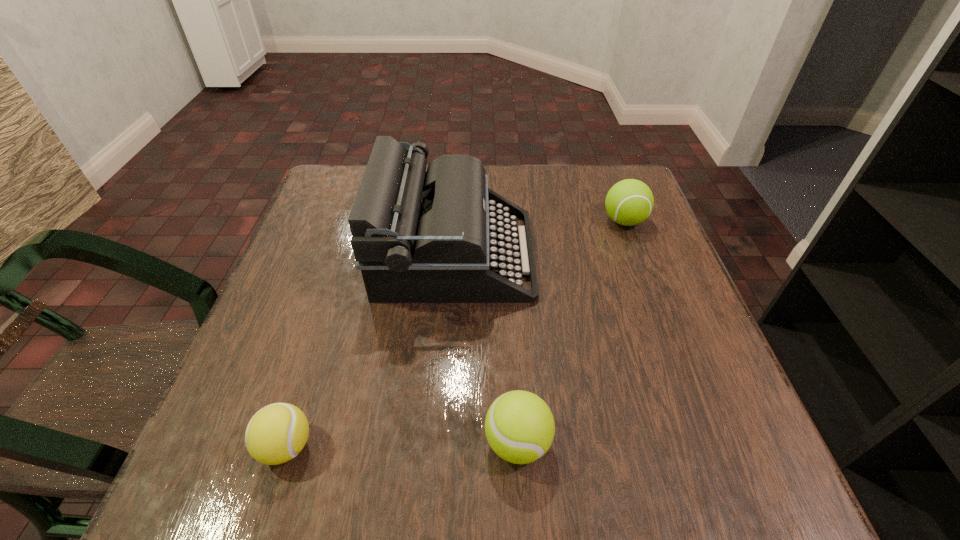
Identify the location of empty space between the shortest tennis ball and the typewriter. (371, 350).

Identify the location of vacant region between the second tennis ball from right to left and the rightmost object. (571, 332).

Choose which object is the second nearest neighbor to the leftmost tennis ball. Please provide its 2D coordinates. Your answer should be formatted as a tuple, i.e. [(x, y)], where the tuple contains the x and y coordinates of a point satisfying the conditions above.

[(519, 426)]

Point out which object is positioned as the second nearest to the leftmost tennis ball. Please provide its 2D coordinates. Your answer should be formatted as a tuple, i.e. [(x, y)], where the tuple contains the x and y coordinates of a point satisfying the conditions above.

[(519, 426)]

Identify the location of tennis ball object that ranks as the third closest to the tallest object. (277, 433).

The width and height of the screenshot is (960, 540). What are the coordinates of `the second closest tennis ball relative to the shortest tennis ball` in the screenshot? It's located at 629,202.

The width and height of the screenshot is (960, 540). What are the coordinates of `blank area in the image that satisfies the following two spatial constraints: 1. on the back side of the rightmost object; 2. on the right side of the leftmost object` in the screenshot? It's located at (358, 221).

This screenshot has width=960, height=540. Find the location of `vacant space that satisfies the following two spatial constraints: 1. on the typing side of the typewriter; 2. on the back side of the second tennis ball from right to left`. vacant space that satisfies the following two spatial constraints: 1. on the typing side of the typewriter; 2. on the back side of the second tennis ball from right to left is located at coordinates (444, 442).

You are a GUI agent. You are given a task and a screenshot of the screen. Output one action in this format:
    pyautogui.click(x=<x>, y=<y>)
    Task: Click on the blank area in the image that satisfies the following two spatial constraints: 1. on the typing side of the tallest object; 2. on the right side of the second tennis ball from left to right
    The width and height of the screenshot is (960, 540).
    Given the screenshot: What is the action you would take?
    pyautogui.click(x=444, y=442)

At what (x,y) coordinates should I click in order to perform the action: click on vacant region that satisfies the following two spatial constraints: 1. on the back side of the farthest tennis ball; 2. on the right side of the leftmost object. Please return your answer as a coordinate pair (x, y). Looking at the image, I should click on (358, 221).